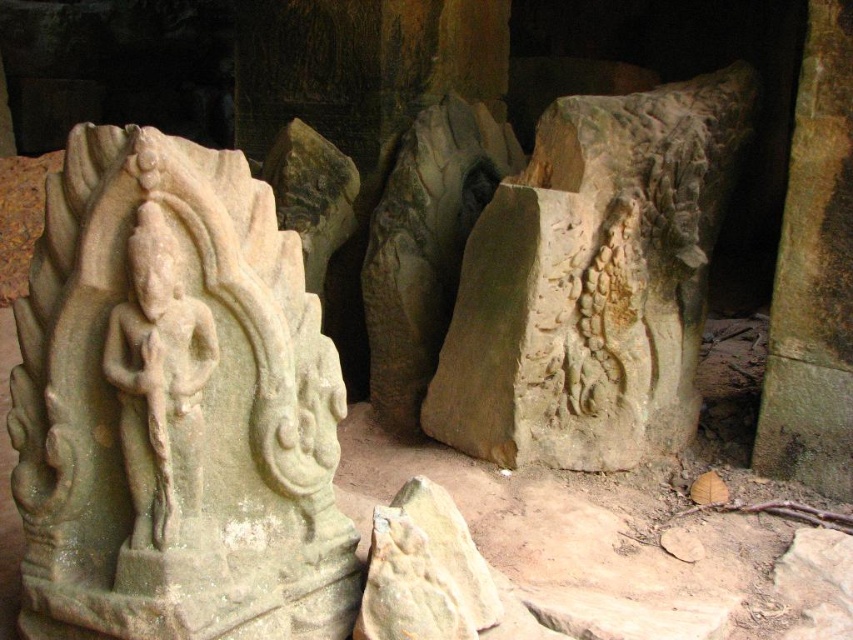
Question: Can you confirm if gray stone carving at center is positioned to the left of white stone deity at left?

Choices:
 (A) no
 (B) yes

Answer: (A)

Question: Is the position of gray stone statue at center less distant than that of white stone deity at left?

Choices:
 (A) yes
 (B) no

Answer: (A)

Question: Does gray stone statue at center appear over gray stone carving at center?

Choices:
 (A) no
 (B) yes

Answer: (A)

Question: Which of the following is the farthest from the observer?

Choices:
 (A) (585, 177)
 (B) (160, 282)

Answer: (A)

Question: Which point is farther to the camera?

Choices:
 (A) gray stone statue at center
 (B) gray stone carving at center
 (C) white stone deity at left

Answer: (B)

Question: Which object is farther from the camera taking this photo?

Choices:
 (A) white stone deity at left
 (B) gray stone statue at center
 (C) gray stone carving at center

Answer: (C)